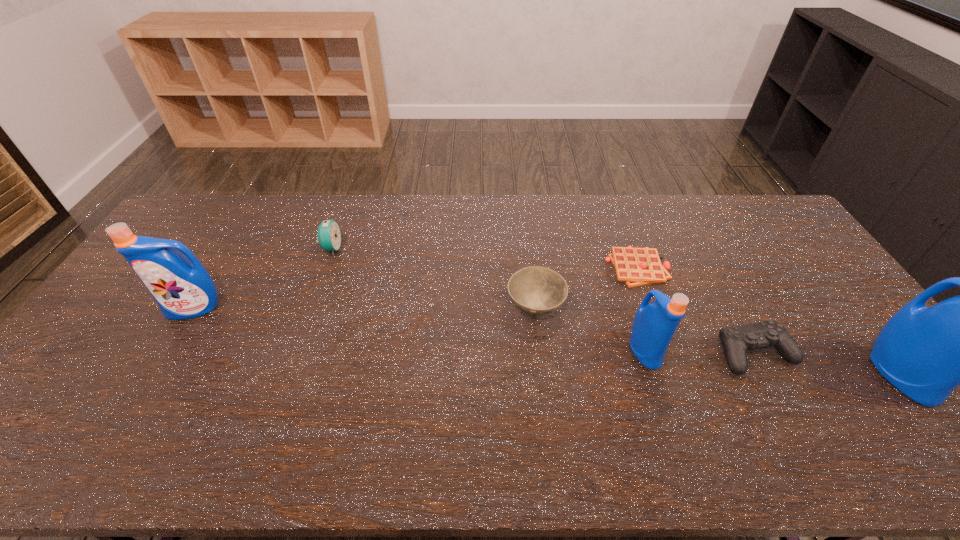
You are a GUI agent. You are given a task and a screenshot of the screen. Output one action in this format:
    pyautogui.click(x=<x>, y=<y>)
    Task: Click on the second tallest detergent
    
    Given the screenshot: What is the action you would take?
    pyautogui.click(x=183, y=289)

Image resolution: width=960 pixels, height=540 pixels. Find the location of `the leftmost detergent`. the leftmost detergent is located at coordinates (183, 289).

Find the location of a particular element. The image size is (960, 540). the third tallest object is located at coordinates (654, 324).

At what (x,y) coordinates should I click in order to perform the action: click on the second detergent from left to right. Please return your answer as a coordinate pair (x, y). This screenshot has height=540, width=960. Looking at the image, I should click on (654, 324).

Find the location of `the tallest detergent`. the tallest detergent is located at coordinates (926, 353).

Find the location of a particular element. the rightmost object is located at coordinates (926, 353).

Where is `the fourth tallest object`? This screenshot has width=960, height=540. the fourth tallest object is located at coordinates (329, 234).

Identify the location of alarm clock. The image size is (960, 540). (329, 234).

Where is `waffle`? waffle is located at coordinates (636, 267).

At what (x,y) coordinates should I click in order to perform the action: click on the second object from right to left. Please return your answer as a coordinate pair (x, y). The width and height of the screenshot is (960, 540). Looking at the image, I should click on (737, 340).